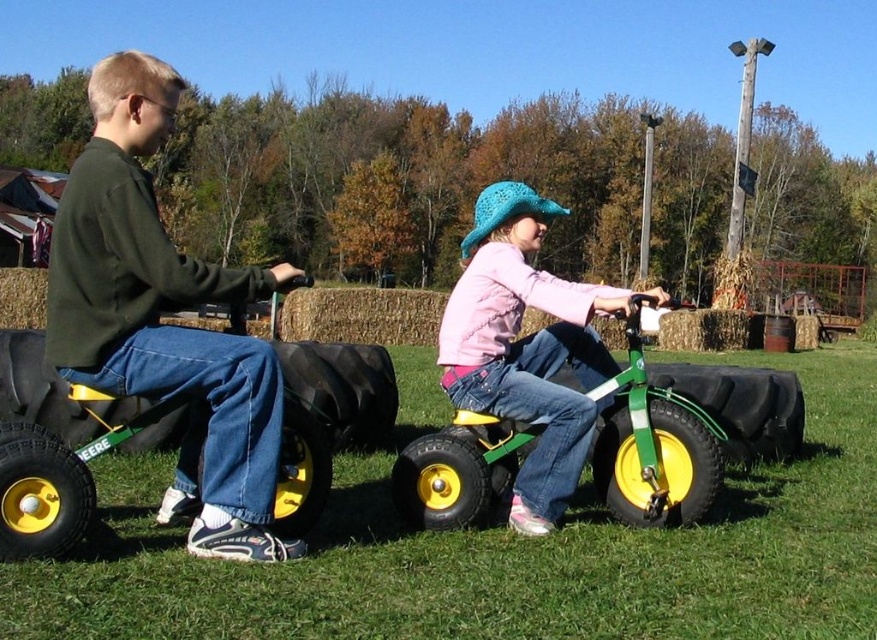
Is matte green tricycle at left behind rubberized green wagon at left?

Yes, matte green tricycle at left is further from the viewer.

Locate an element on the screen. The width and height of the screenshot is (877, 640). matte green tricycle at left is located at coordinates (x=158, y=317).

Which is behind, point (140, 378) or point (294, 412)?

The point (294, 412) is behind.

Identify the location of matte green tricycle at left. (158, 317).

Based on the photo, who is more forward, (x=522, y=218) or (x=332, y=346)?

Point (x=522, y=218)

Is point (523, 269) more distant than point (381, 426)?

That is False.

Who is more forward, [485,301] or [314,442]?

Point [314,442] is more forward.

In order to click on pink matte jacket at center in this screenshot , I will do `click(525, 348)`.

Who is more distant from viewer, (x=672, y=307) or (x=303, y=365)?

The point (x=303, y=365) is more distant.

Measure the distance between green matte tricycle at center and rubberized green wagon at left.

33.04 inches

Who is more forward, (733,369) or (34,346)?

Point (34,346)

What are the coordinates of `green matte tricycle at center` in the screenshot? It's located at (683, 429).